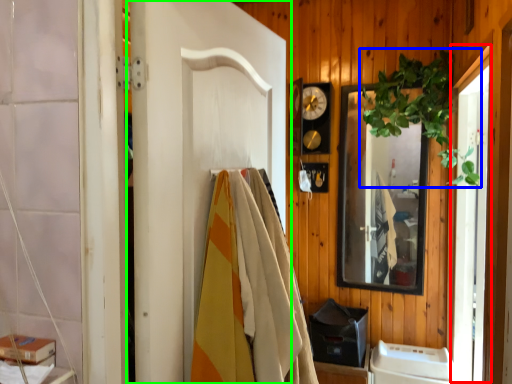
Question: Estimate the real-world distances between objects in this image. Which object is closer to screen door (highlighted by a red box), plant (highlighted by a blue box) or door (highlighted by a green box)?

Choices:
 (A) plant
 (B) door

Answer: (A)